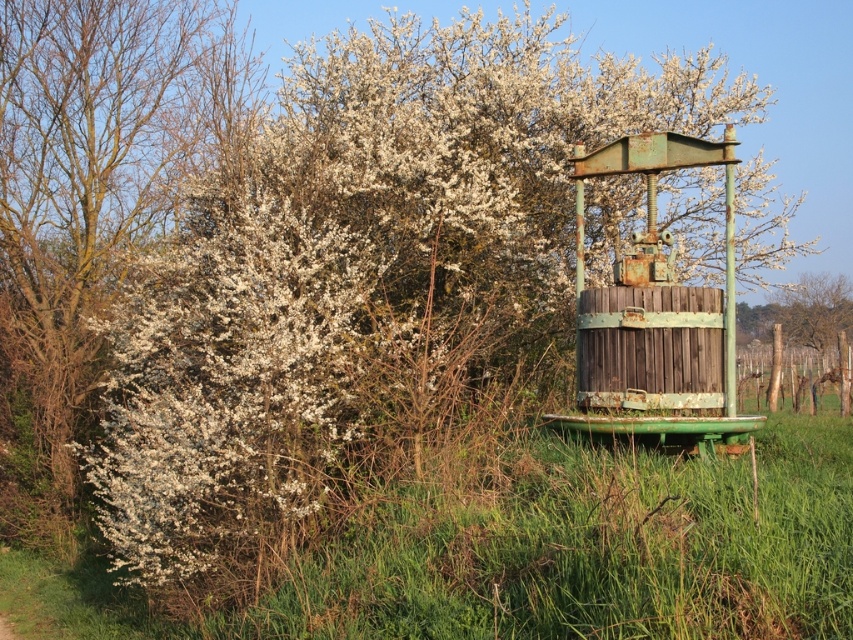
You are standing next to the rustic wooden press and looking towards the green grass at right and the white blossoms at left. Which object is positioned lower in the scene?

The green grass at right is located below the white blossoms at left, so the green grass at right is positioned lower in the scene.

You are a gardener who needs to mow the lawn. You see the green grass at right and the white blossoms at left. Which area requires more attention for mowing based on their widths?

The green grass at right requires more attention because its width is less than the white blossoms at left, meaning it might be shorter and need trimming soon to maintain evenness.

You are standing at the center of the image and want to step onto the green grass at right. In which direction should you move?

The green grass at right is located at point coordinates, so you should move to the right direction to reach it.